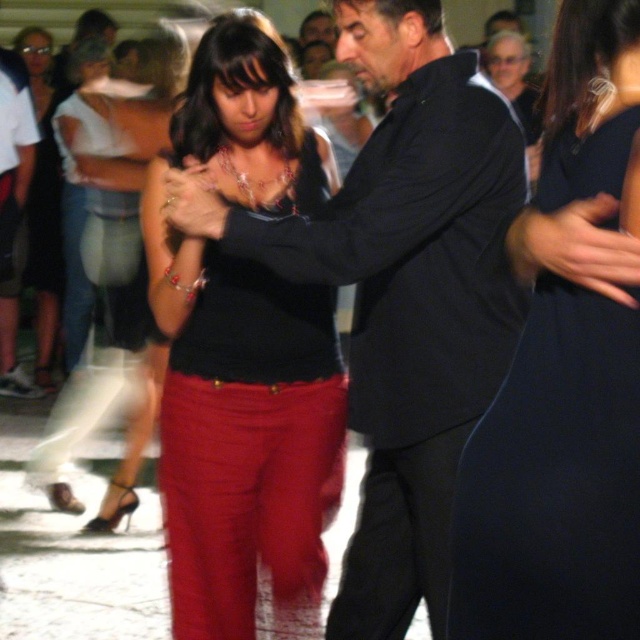
Question: Among these points, which one is farthest from the camera?

Choices:
 (A) (369, 563)
 (B) (493, 497)
 (C) (337, 179)

Answer: (C)

Question: Is matte black suit at center below matte black top at upper left?

Choices:
 (A) no
 (B) yes

Answer: (B)

Question: Does black satin dress at center appear over matte black top at upper left?

Choices:
 (A) no
 (B) yes

Answer: (A)

Question: Which is nearer to the matte black top at center?

Choices:
 (A) black satin dress at center
 (B) matte black top at upper left
 (C) matte black suit at center
 (D) black smooth pants at center

Answer: (C)

Question: Which point is farther to the camera?

Choices:
 (A) (529, 596)
 (B) (426, 461)

Answer: (B)

Question: Observing the image, what is the correct spatial positioning of matte black top at center in reference to black smooth pants at center?

Choices:
 (A) left
 (B) right

Answer: (A)